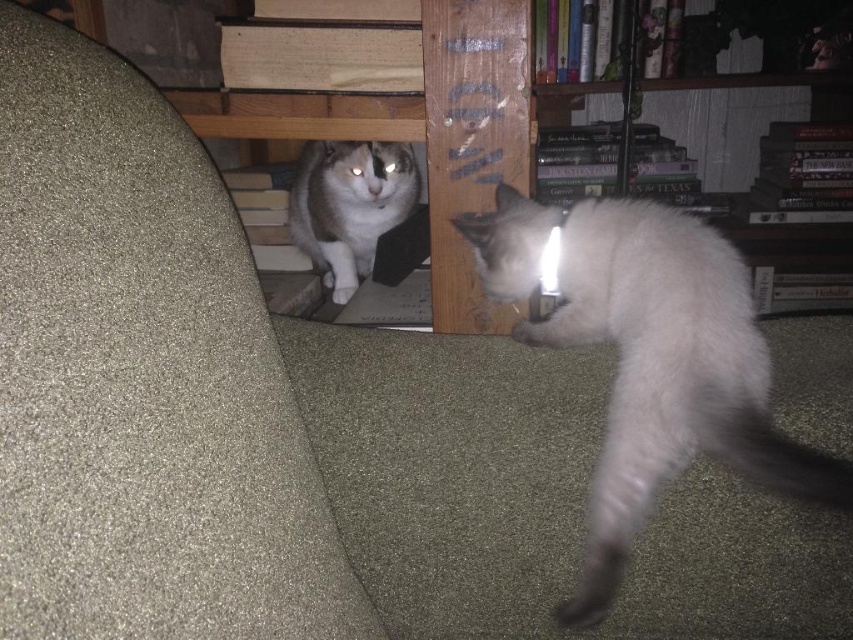
Question: Is gray fur cat at center wider than gray fur tail at lower right?

Choices:
 (A) no
 (B) yes

Answer: (B)

Question: Is gray fur cat at center thinner than gray fur tail at lower right?

Choices:
 (A) yes
 (B) no

Answer: (B)

Question: Which point is closer to the camera?

Choices:
 (A) white fur cat at lower right
 (B) gray fur tail at lower right

Answer: (A)

Question: Which object appears closest to the camera in this image?

Choices:
 (A) gray fur tail at lower right
 (B) gray fur cat at center

Answer: (A)

Question: Which point appears closest to the camera in this image?

Choices:
 (A) (758, 449)
 (B) (636, 499)

Answer: (A)

Question: Can you confirm if white fur cat at lower right is positioned to the right of gray fur cat at center?

Choices:
 (A) no
 (B) yes

Answer: (B)